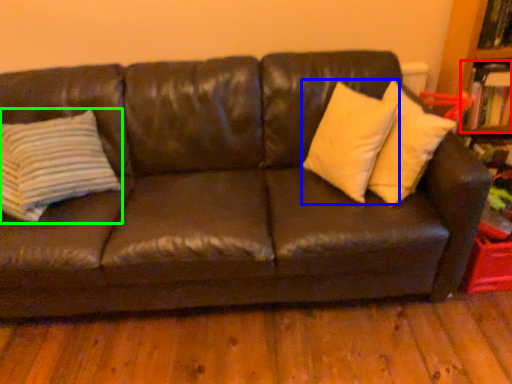
Question: Which object is positioned farthest from book (highlighted by a red box)? Select from pillow (highlighted by a blue box) and pillow (highlighted by a green box).

Choices:
 (A) pillow
 (B) pillow

Answer: (B)